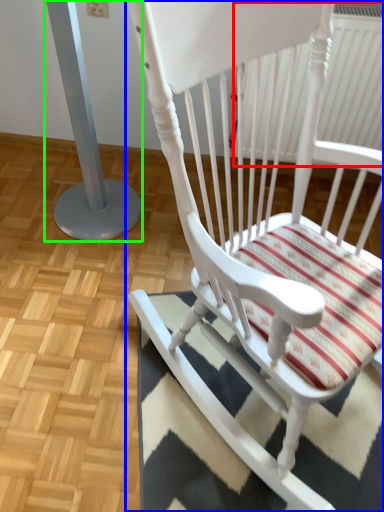
Question: Which object is the farthest from radiator (highlighted by a red box)? Choose among these: chair (highlighted by a blue box) or pillar (highlighted by a green box).

Choices:
 (A) chair
 (B) pillar

Answer: (B)